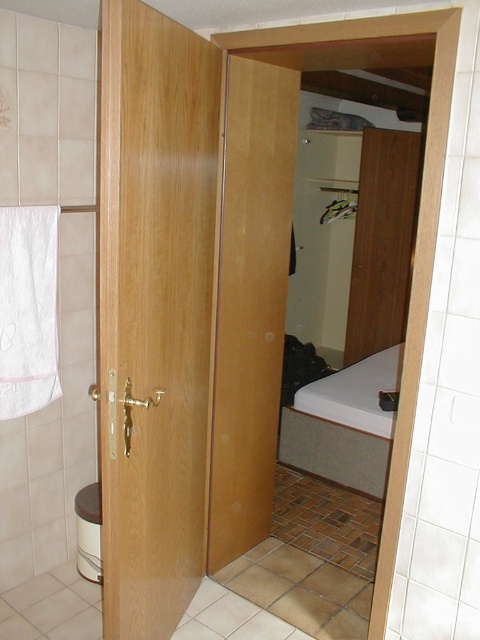
You are standing in a hallway and see the wooden door at center. If you want to walk towards it, which direction should you move?

Since the wooden door at center is positioned at point (250,301), you should move towards the center of the hallway to reach it.

You are standing in the bathroom and want to reach the closet door in the bedroom. The closet door is partially open. If you walk straight towards the closet door, will you first pass through the point at coordinates point (180, 531)?

The point at coordinates point (180, 531) is 6.98 feet away from the viewer. Since the closet door is in the bedroom beyond the partially open wooden door, you would need to pass through the point to reach the closet door. Therefore, yes, you will first pass through the point at coordinates point (180, 531) when walking straight towards the closet door.